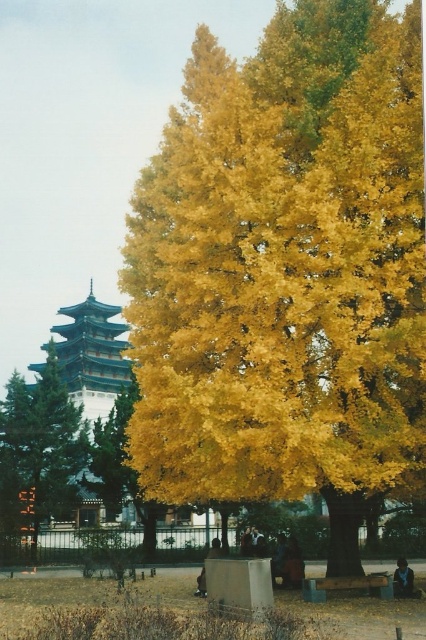
Is point (178, 189) less distant than point (74, 312)?

Yes, point (178, 189) is closer to viewer.

Does golden leafy tree at center have a smaller size compared to teal glossy pagoda at left?

Yes, golden leafy tree at center is smaller than teal glossy pagoda at left.

Measure the distance between golden leafy tree at center and camera.

golden leafy tree at center and camera are 19.50 meters apart from each other.

The width and height of the screenshot is (426, 640). What are the coordinates of `golden leafy tree at center` in the screenshot? It's located at (284, 269).

Which of these two, yellow/golden leafy tree at center-left or teal glossy pagoda at left, stands taller?

Standing taller between the two is teal glossy pagoda at left.

Is yellow/golden leafy tree at center-left in front of teal glossy pagoda at left?

That is True.

Is point (57, 445) positioned after point (92, 305)?

No.

Find the location of a particular element. This screenshot has height=640, width=426. yellow/golden leafy tree at center-left is located at coordinates (37, 451).

Between golden leafy tree at center and yellow/golden leafy tree at center-left, which one appears on the right side from the viewer's perspective?

Positioned to the right is golden leafy tree at center.

Between golden leafy tree at center and yellow/golden leafy tree at center-left, which one appears on the left side from the viewer's perspective?

Positioned to the left is yellow/golden leafy tree at center-left.

Is point (305, 460) positioned after point (77, 435)?

No, it is not.

Where is `golden leafy tree at center`? The height and width of the screenshot is (640, 426). golden leafy tree at center is located at coordinates (284, 269).